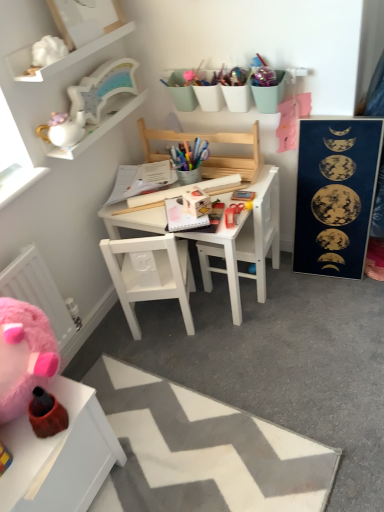
Find the location of a particular element. This screenshot has width=384, height=512. free space that is in between blue matte poster at right and white wooden changing table at center is located at coordinates (297, 285).